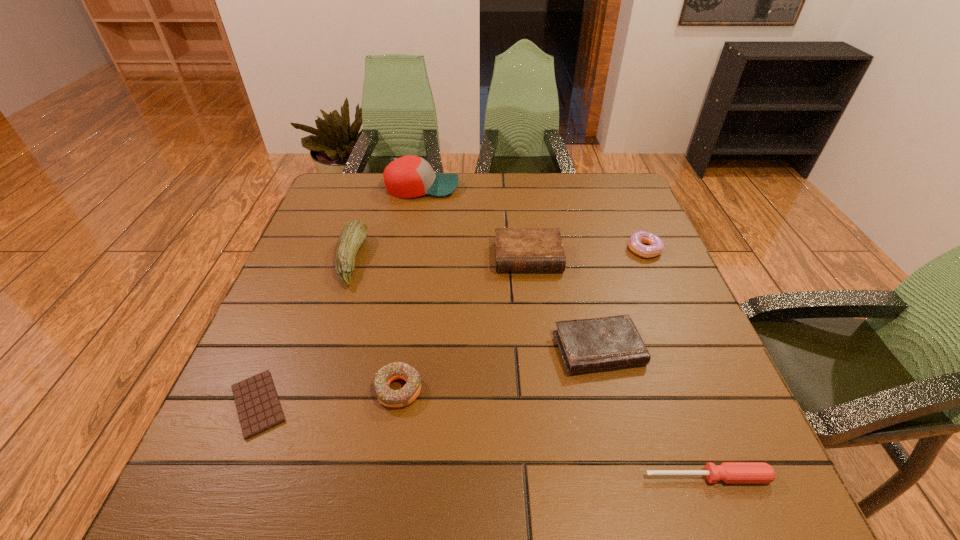
The width and height of the screenshot is (960, 540). Identify the location of the shortest object. (258, 407).

I want to click on free region located at the brim of the baseball cap, so click(x=494, y=187).

In order to click on free spot located 0.080m at the stem end of the zucchini in this screenshot , I will do `click(396, 260)`.

Identify the location of free region located on the spine side of the third tallest object. pos(535,311).

Where is `free space located 0.260m on the front of the farther doughnut`? This screenshot has height=540, width=960. free space located 0.260m on the front of the farther doughnut is located at coordinates (684, 340).

Image resolution: width=960 pixels, height=540 pixels. I want to click on free region located 0.060m on the front of the nearer doughnut, so click(x=391, y=442).

The image size is (960, 540). I want to click on vacant area situated on the front of the nearer diary, so click(x=636, y=500).

You are a GUI agent. You are given a task and a screenshot of the screen. Output one action in this format:
    pyautogui.click(x=<x>, y=<y>)
    Task: Click on the vacant space situated 0.280m on the left of the second shortest object
    Image resolution: width=960 pixels, height=540 pixels.
    Given the screenshot: What is the action you would take?
    pyautogui.click(x=475, y=477)

Image resolution: width=960 pixels, height=540 pixels. In order to click on free spot located on the right of the shortest object in this screenshot , I will do `click(473, 404)`.

Locate an element on the screen. Image resolution: width=960 pixels, height=540 pixels. object located in the far edge section of the desktop is located at coordinates (410, 176).